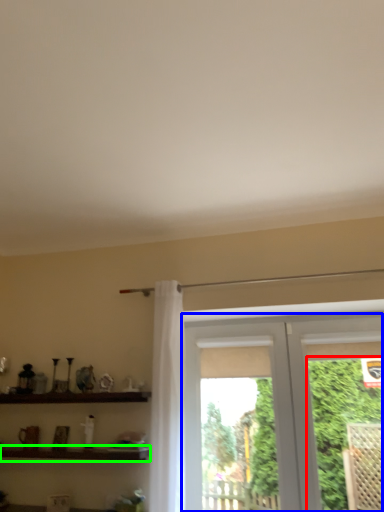
Question: Which object is the farthest from plant (highlighted by a red box)? Choose among these: window (highlighted by a blue box) or shelf (highlighted by a green box).

Choices:
 (A) window
 (B) shelf

Answer: (B)